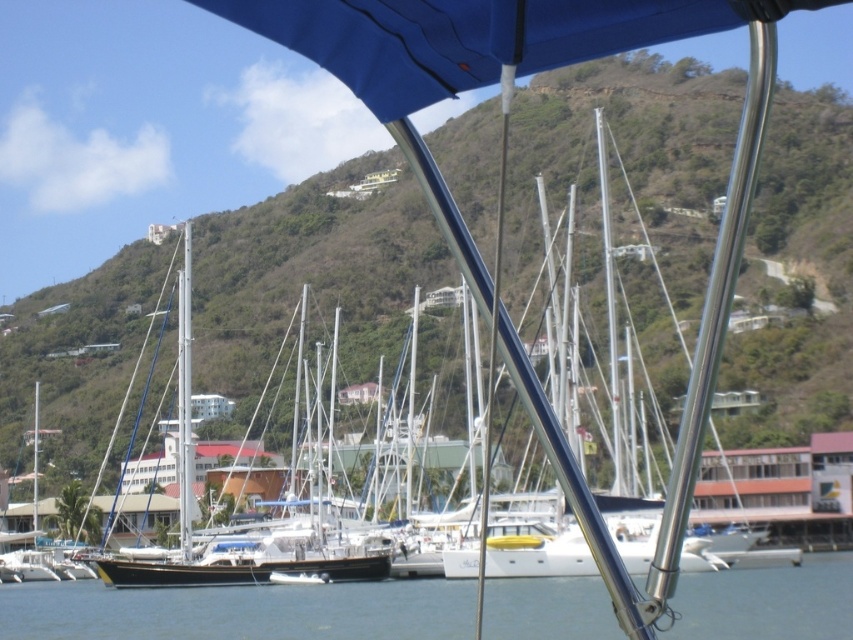
Does green leafy hillside at center have a larger size compared to clear blue water at lower center?

Correct, green leafy hillside at center is larger in size than clear blue water at lower center.

Can you confirm if green leafy hillside at center is positioned to the left of clear blue water at lower center?

Yes, green leafy hillside at center is to the left of clear blue water at lower center.

Is point (753, 428) less distant than point (289, 637)?

No, it is behind (289, 637).

Locate an element on the screen. green leafy hillside at center is located at coordinates click(310, 273).